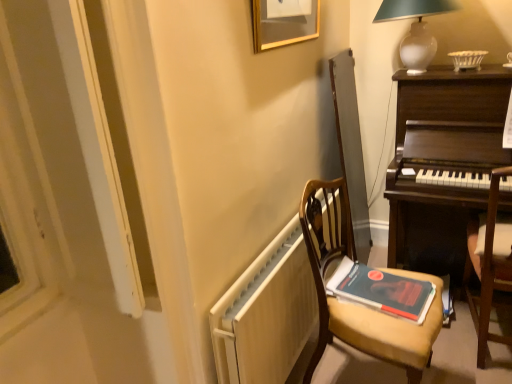
Question: Are gold-framed picture at upper center and white glass table lamp at upper right far apart?

Choices:
 (A) no
 (B) yes

Answer: (A)

Question: Is gold-framed picture at upper center turned away from white glass table lamp at upper right?

Choices:
 (A) yes
 (B) no

Answer: (B)

Question: Considering the relative positions of gold-framed picture at upper center and white glass table lamp at upper right in the image provided, is gold-framed picture at upper center behind white glass table lamp at upper right?

Choices:
 (A) no
 (B) yes

Answer: (A)

Question: Can you confirm if gold-framed picture at upper center is smaller than white glass table lamp at upper right?

Choices:
 (A) yes
 (B) no

Answer: (A)

Question: Is gold-framed picture at upper center placed right next to white glass table lamp at upper right?

Choices:
 (A) yes
 (B) no

Answer: (B)

Question: From the image's perspective, is dark wood piano at right above or below wooden chair at center, the 1th chair viewed from the left?

Choices:
 (A) above
 (B) below

Answer: (A)

Question: From a real-world perspective, relative to wooden chair at center, the second chair viewed from the right, is dark wood piano at right vertically above or below?

Choices:
 (A) below
 (B) above

Answer: (B)

Question: Would you say dark wood piano at right is to the left or to the right of wooden chair at center, the 1th chair viewed from the left, in the picture?

Choices:
 (A) right
 (B) left

Answer: (A)

Question: Considering their positions, is dark wood piano at right located in front of or behind wooden chair at center, the 1th chair viewed from the left?

Choices:
 (A) front
 (B) behind

Answer: (B)

Question: Based on their positions, is hardcover book at center located to the left or right of white matte radiator at lower center?

Choices:
 (A) left
 (B) right

Answer: (B)

Question: In the image, is hardcover book at center positioned in front of or behind white matte radiator at lower center?

Choices:
 (A) front
 (B) behind

Answer: (B)

Question: From the image's perspective, is hardcover book at center above or below white matte radiator at lower center?

Choices:
 (A) above
 (B) below

Answer: (A)

Question: From a real-world perspective, is hardcover book at center above or below white matte radiator at lower center?

Choices:
 (A) above
 (B) below

Answer: (A)

Question: From the image's perspective, is dark wood piano at right positioned above or below wooden chair at right, which is the 2th chair in left-to-right order?

Choices:
 (A) above
 (B) below

Answer: (A)

Question: Would you say dark wood piano at right is to the left or to the right of wooden chair at right, which is the first chair from right to left, in the picture?

Choices:
 (A) right
 (B) left

Answer: (B)